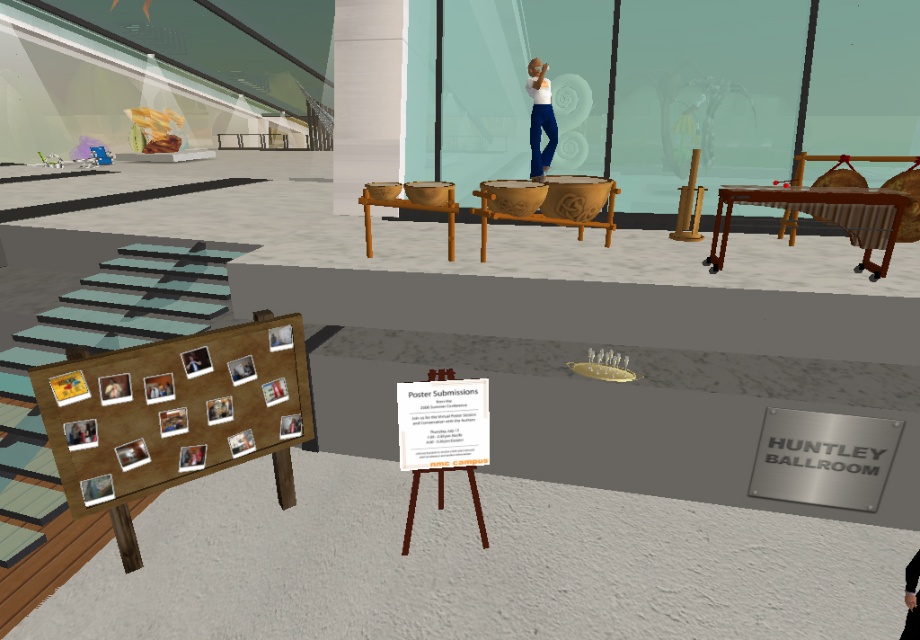
Question: Does white matte shirt at upper center have a greater width compared to dark gray sweater at center?

Choices:
 (A) no
 (B) yes

Answer: (B)

Question: Which point is closer to the camera taking this photo?

Choices:
 (A) (483, 220)
 (B) (168, 449)
 (C) (395, 202)

Answer: (B)

Question: Estimate the real-world distances between objects in this image. Which object is farther from the wooden carved drums at center?

Choices:
 (A) wooden bowls at center
 (B) dark gray sweater at center
 (C) wooden marimba at center

Answer: (B)

Question: Does wooden marimba at center have a larger size compared to white matte shirt at upper center?

Choices:
 (A) yes
 (B) no

Answer: (A)

Question: Is wooden board at lower left to the right of dark gray sweater at center from the viewer's perspective?

Choices:
 (A) yes
 (B) no

Answer: (B)

Question: Which point is closer to the camera taking this photo?

Choices:
 (A) (880, 198)
 (B) (92, 500)

Answer: (B)